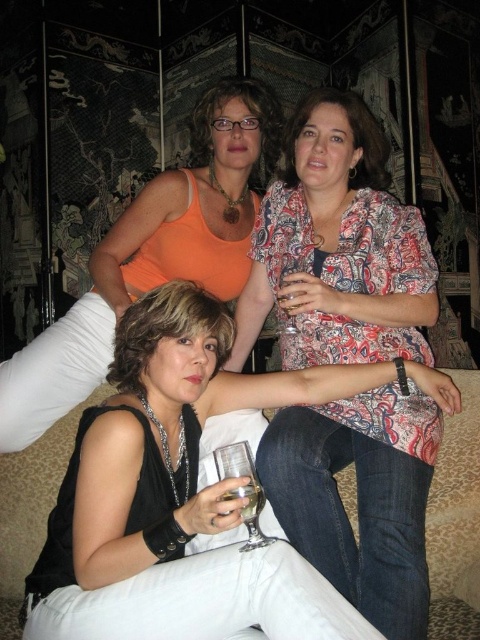
Between printed fabric blouse at center and clear glass at lower center, which one has less height?

With less height is clear glass at lower center.

Between printed fabric blouse at center and clear glass at lower center, which one has more height?

printed fabric blouse at center is taller.

Does point (264, 476) lie in front of point (256, 500)?

No, it is not.

I want to click on printed fabric blouse at center, so pos(338,246).

Does printed fabric blouse at center lie in front of clear glass wine glass at lower center?

No, it is behind clear glass wine glass at lower center.

From the picture: Measure the distance between printed fabric blouse at center and camera.

1.62 meters

Where is `printed fabric blouse at center`? This screenshot has height=640, width=480. printed fabric blouse at center is located at coordinates (338, 246).

Where is `black leather jacket at center`? Image resolution: width=480 pixels, height=640 pixels. black leather jacket at center is located at coordinates (183, 492).

What do you see at coordinates (183, 492) in the screenshot?
I see `black leather jacket at center` at bounding box center [183, 492].

Who is more distant from viewer, (85, 419) or (292, 262)?

Positioned behind is point (292, 262).

Image resolution: width=480 pixels, height=640 pixels. What are the coordinates of `black leather jacket at center` in the screenshot? It's located at (183, 492).